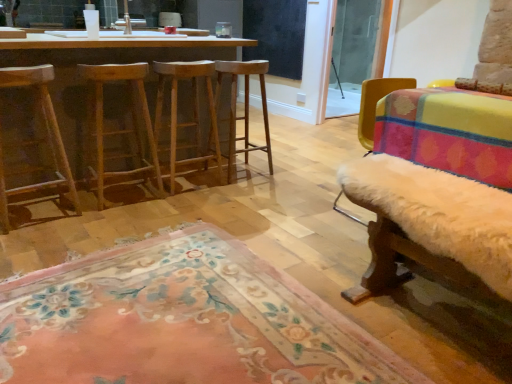
Identify the location of free spot to the right of wooden stool at left. (94, 226).